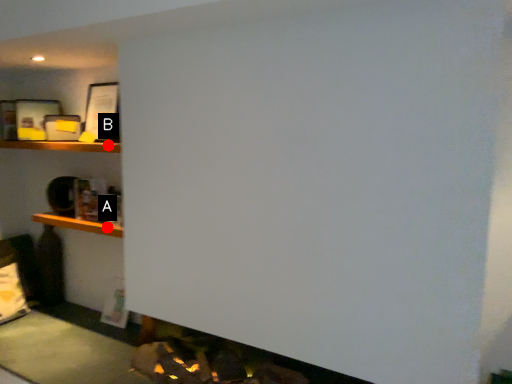
Question: Two points are circled on the image, labeled by A and B beside each circle. Which point appears closest to the camera in this image?

Choices:
 (A) A is closer
 (B) B is closer

Answer: (A)